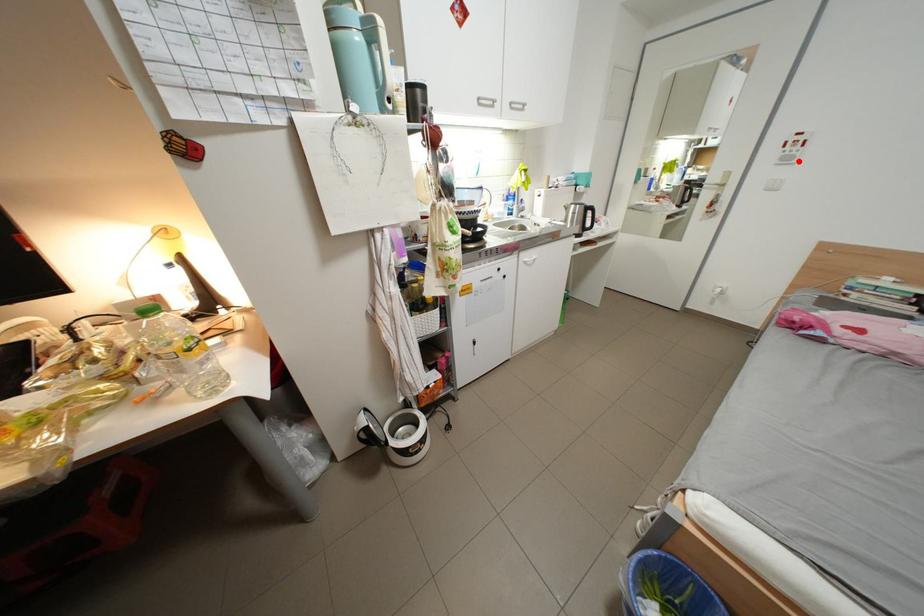
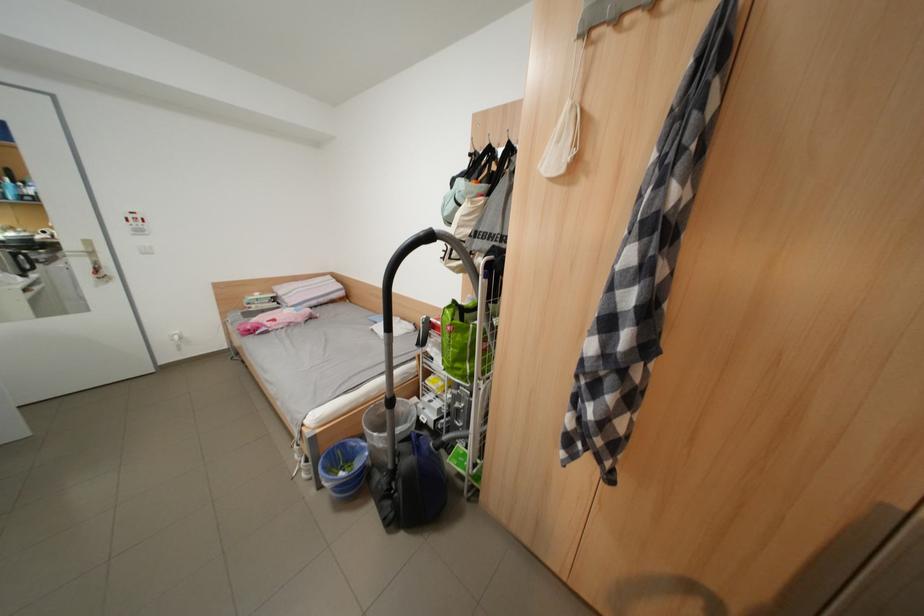
The point at the highlighted location is marked in the first image. Where is the corresponding point in the second image?

(152, 233)